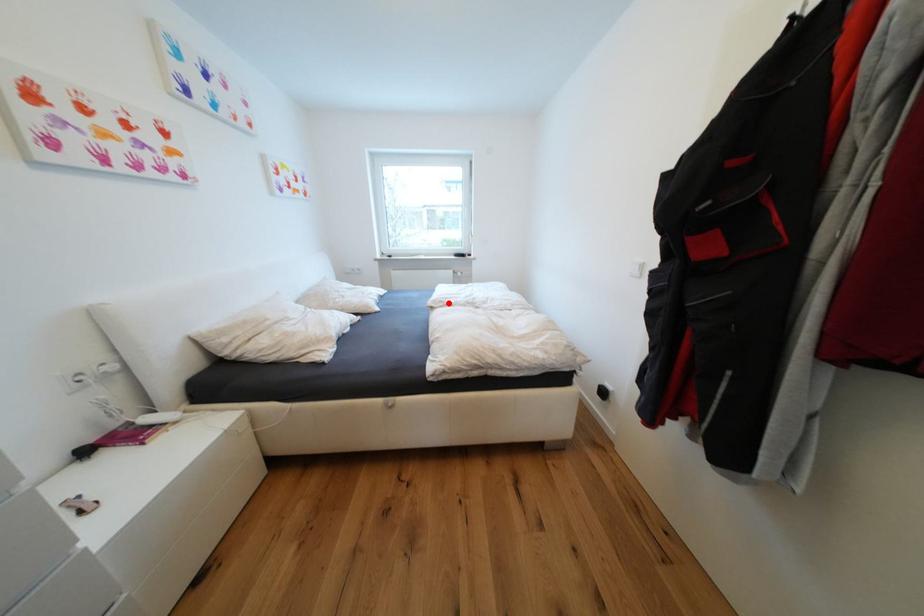
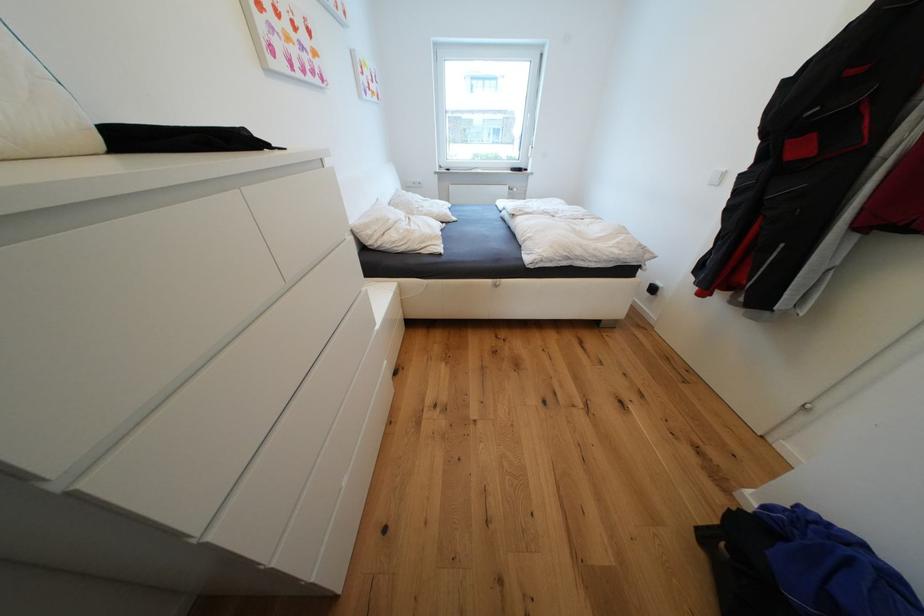
Where in the second image is the point corresponding to the highlighted location from the first image?

(528, 212)